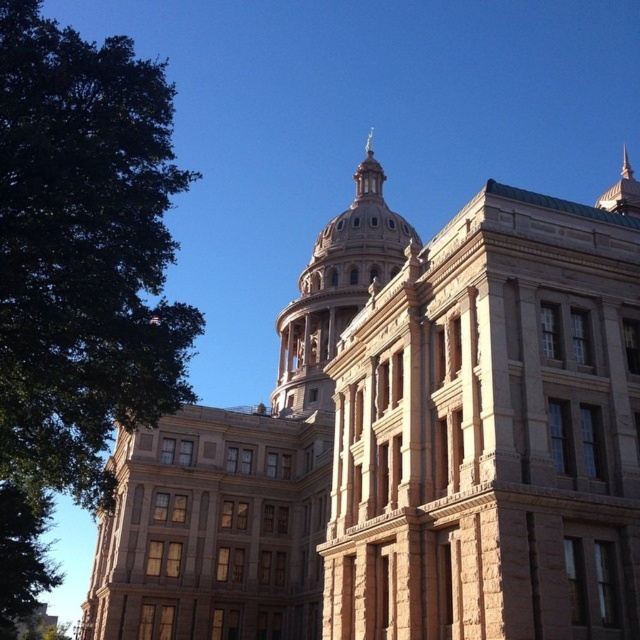
Question: Among these points, which one is nearest to the camera?

Choices:
 (A) (403, 237)
 (B) (19, 593)

Answer: (B)

Question: Does green leafy tree at left have a lesser width compared to green leafy tree at lower left?

Choices:
 (A) yes
 (B) no

Answer: (A)

Question: Estimate the real-world distances between objects in this image. Which object is farther from the golden stone dome at center?

Choices:
 (A) green leafy tree at left
 (B) green leafy tree at lower left

Answer: (B)

Question: Can you confirm if green leafy tree at left is smaller than green leafy tree at lower left?

Choices:
 (A) yes
 (B) no

Answer: (A)

Question: Can you confirm if green leafy tree at left is positioned to the right of green leafy tree at lower left?

Choices:
 (A) no
 (B) yes

Answer: (B)

Question: Estimate the real-world distances between objects in this image. Which object is closer to the golden stone dome at center?

Choices:
 (A) green leafy tree at lower left
 (B) green leafy tree at left

Answer: (B)